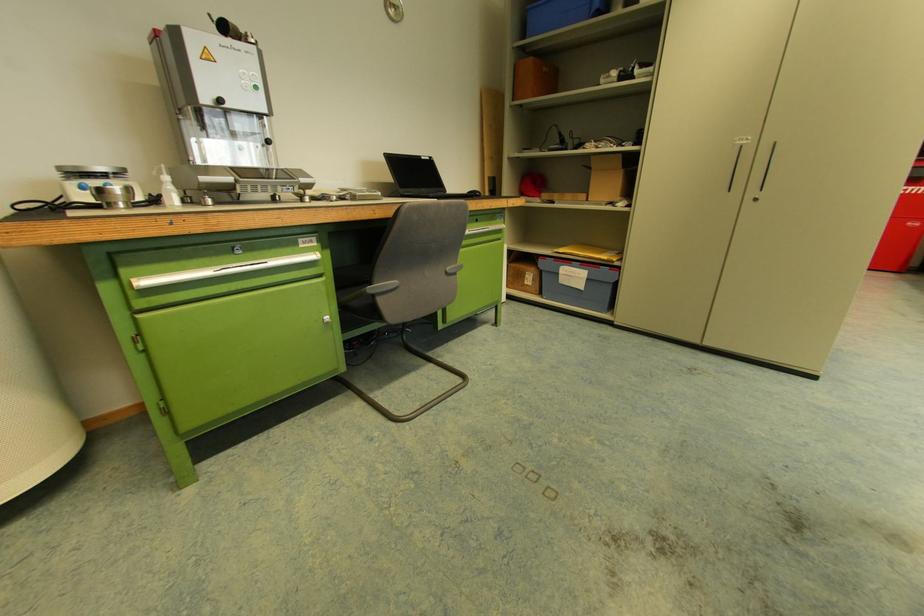
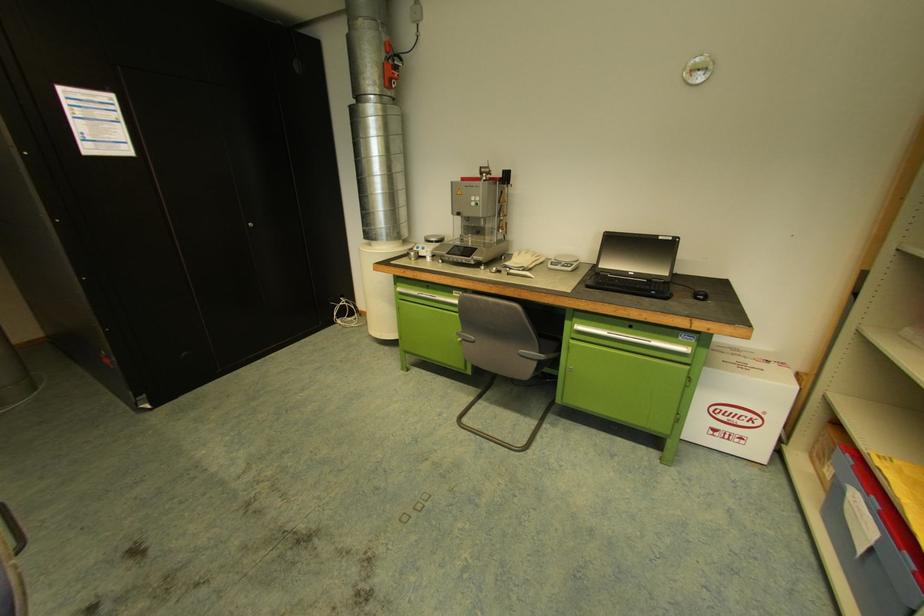
Question: I am providing you with two images of the same scene from different viewpoints. Please identify which objects are invisible in image2.

Choices:
 (A) white digital scale
 (B) red machine button
 (C) white cardboard box
 (D) none of these

Answer: (D)